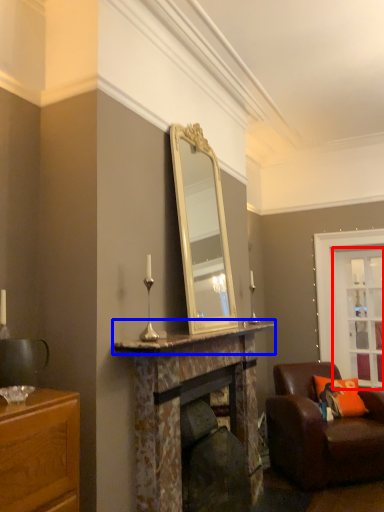
Question: Which object appears farthest to the camera in this image, glass door (highlighted by a red box) or mantle (highlighted by a blue box)?

Choices:
 (A) glass door
 (B) mantle

Answer: (A)